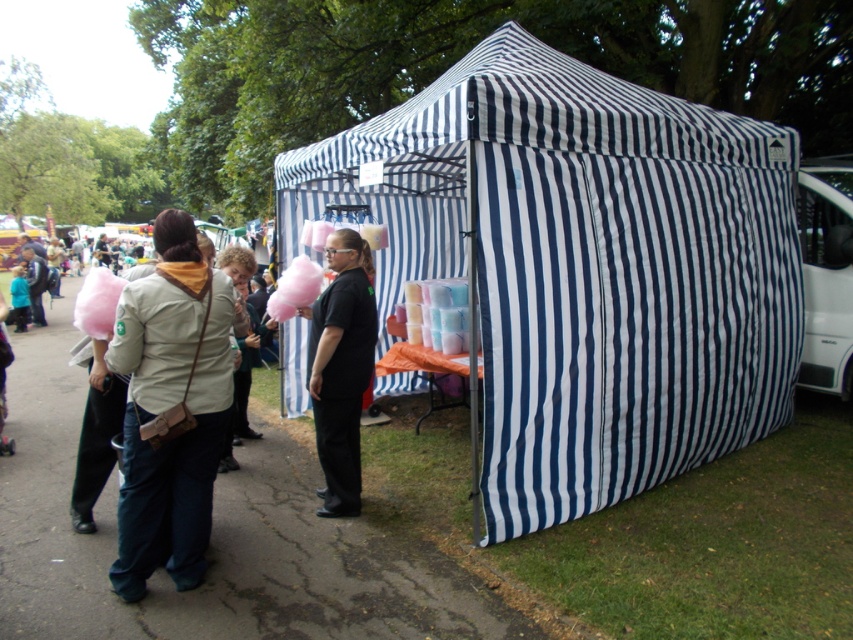
Is blue and white striped tent at center to the left of black matte shirt at center from the viewer's perspective?

In fact, blue and white striped tent at center is to the right of black matte shirt at center.

Describe the element at coordinates (583, 266) in the screenshot. The height and width of the screenshot is (640, 853). I see `blue and white striped tent at center` at that location.

Locate an element on the screen. The height and width of the screenshot is (640, 853). blue and white striped tent at center is located at coordinates (583, 266).

Consider the image. Can you confirm if light beige fabric jacket at center is positioned to the right of black matte shirt at center?

No, light beige fabric jacket at center is not to the right of black matte shirt at center.

Consider the image. Which is below, light beige fabric jacket at center or black matte shirt at center?

light beige fabric jacket at center

Is point (200, 520) positioned in front of point (337, 360)?

Yes, it is.

You are a GUI agent. You are given a task and a screenshot of the screen. Output one action in this format:
    pyautogui.click(x=<x>, y=<y>)
    Task: Click on the light beige fabric jacket at center
    This screenshot has width=853, height=640.
    Given the screenshot: What is the action you would take?
    pyautogui.click(x=169, y=406)

Who is lower down, blue and white striped tent at center or light beige fabric jacket at center?

Positioned lower is light beige fabric jacket at center.

What do you see at coordinates (583, 266) in the screenshot? This screenshot has height=640, width=853. I see `blue and white striped tent at center` at bounding box center [583, 266].

Who is more forward, (515, 490) or (213, 396)?

Point (213, 396)

At what (x,y) coordinates should I click in order to perform the action: click on blue and white striped tent at center. Please return your answer as a coordinate pair (x, y). Looking at the image, I should click on (583, 266).